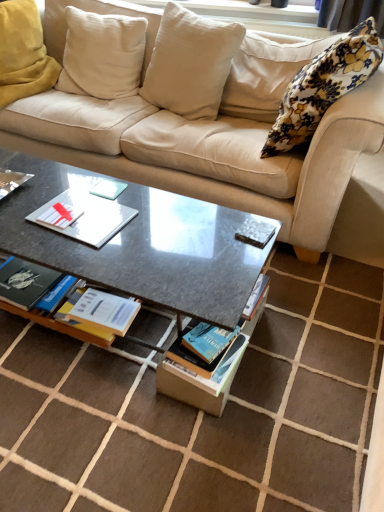
Question: From a real-world perspective, is hardcover book at center, which is the first book from bottom to top, physically below metallic silver magazine at center, the 2th magazine ordered from the bottom?

Choices:
 (A) no
 (B) yes

Answer: (B)

Question: Considering the relative positions of hardcover book at center, acting as the second book starting from the top, and metallic silver magazine at center, the 2th magazine ordered from the bottom, in the image provided, is hardcover book at center, acting as the second book starting from the top, in front of metallic silver magazine at center, the 2th magazine ordered from the bottom,?

Choices:
 (A) no
 (B) yes

Answer: (A)

Question: Could you tell me if hardcover book at center, acting as the second book starting from the top, is facing metallic silver magazine at center, the 1th magazine viewed from the top?

Choices:
 (A) yes
 (B) no

Answer: (B)

Question: Does hardcover book at center, the first book positioned from the right, have a lesser height compared to metallic silver magazine at center, the 2th magazine ordered from the bottom?

Choices:
 (A) yes
 (B) no

Answer: (B)

Question: Does hardcover book at center, acting as the second book starting from the left, appear on the left side of metallic silver magazine at center, the 1th magazine viewed from the top?

Choices:
 (A) no
 (B) yes

Answer: (B)

Question: From the image's perspective, is hardcover book at center, acting as the second book starting from the left, beneath metallic silver magazine at center, the 2th magazine ordered from the bottom?

Choices:
 (A) yes
 (B) no

Answer: (A)

Question: Are blue matte book at center, which is the 1th magazine from bottom to top, and white matte paper at center far apart?

Choices:
 (A) yes
 (B) no

Answer: (B)

Question: From a real-world perspective, is blue matte book at center, which is the 1th magazine from bottom to top, over white matte paper at center?

Choices:
 (A) no
 (B) yes

Answer: (A)

Question: Can you confirm if blue matte book at center, placed as the 2th magazine when sorted from top to bottom, is thinner than white matte paper at center?

Choices:
 (A) yes
 (B) no

Answer: (B)

Question: From the image's perspective, is blue matte book at center, placed as the 2th magazine when sorted from top to bottom, on white matte paper at center?

Choices:
 (A) yes
 (B) no

Answer: (B)

Question: Could you tell me if blue matte book at center, placed as the 2th magazine when sorted from top to bottom, is facing white matte paper at center?

Choices:
 (A) no
 (B) yes

Answer: (A)

Question: Considering the relative sizes of blue matte book at center, placed as the 2th magazine when sorted from top to bottom, and white matte paper at center in the image provided, is blue matte book at center, placed as the 2th magazine when sorted from top to bottom, wider than white matte paper at center?

Choices:
 (A) no
 (B) yes

Answer: (B)

Question: Can you confirm if hardcover book at center, acting as the second book starting from the top, is wider than blue matte book at center, which is the 1th magazine from bottom to top?

Choices:
 (A) no
 (B) yes

Answer: (A)